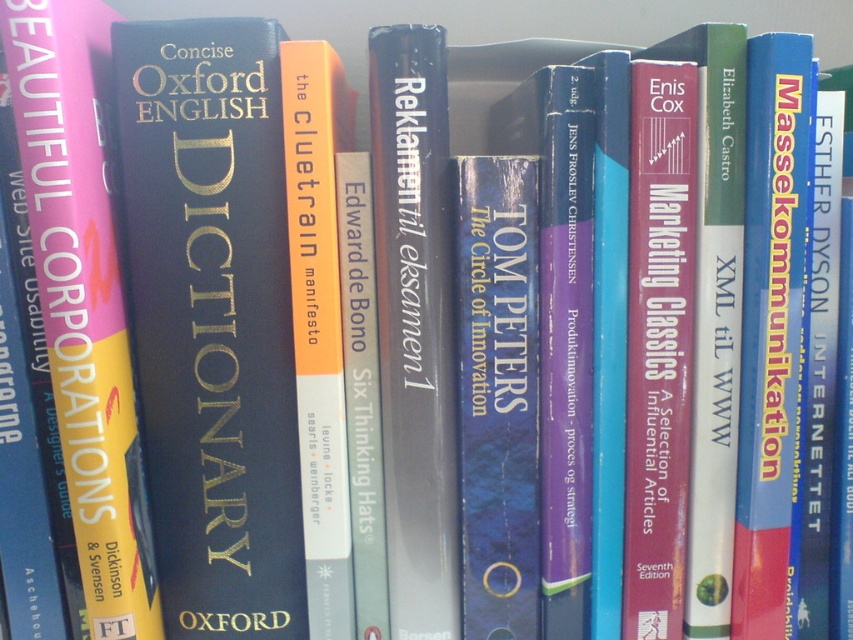
What object is located at the coordinates point (212, 321) on the shelf?

The point (212, 321) corresponds to the matte black dictionary at center.